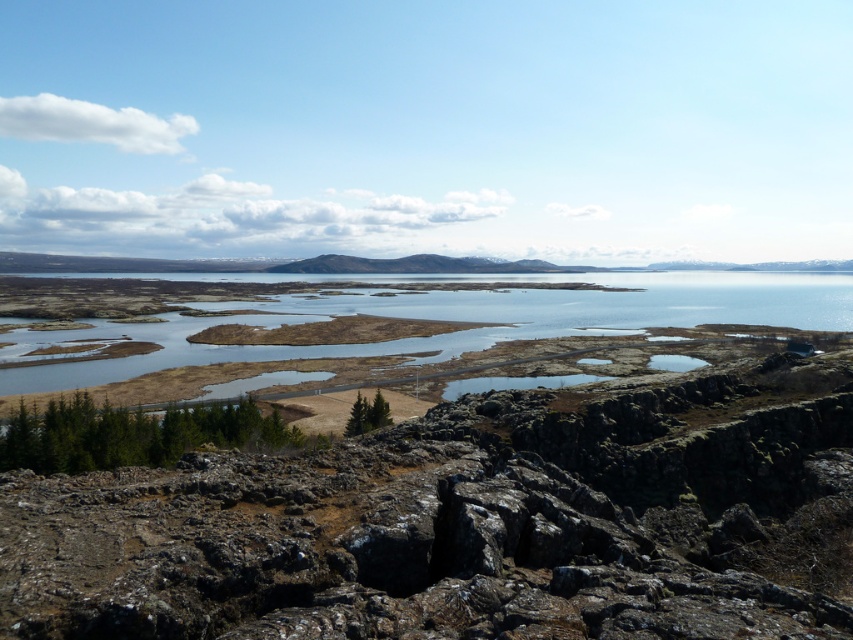
Question: Which of the following is the farthest from the observer?

Choices:
 (A) clear water at center
 (B) rusty rock at center

Answer: (A)

Question: Is rusty rock at center to the left of clear water at center from the viewer's perspective?

Choices:
 (A) no
 (B) yes

Answer: (B)

Question: Which object appears farthest from the camera in this image?

Choices:
 (A) rusty rock at center
 (B) clear water at center

Answer: (B)

Question: Is rusty rock at center bigger than clear water at center?

Choices:
 (A) yes
 (B) no

Answer: (B)

Question: Which of the following is the closest to the observer?

Choices:
 (A) clear water at center
 (B) rusty rock at center

Answer: (B)

Question: Is rusty rock at center thinner than clear water at center?

Choices:
 (A) yes
 (B) no

Answer: (A)